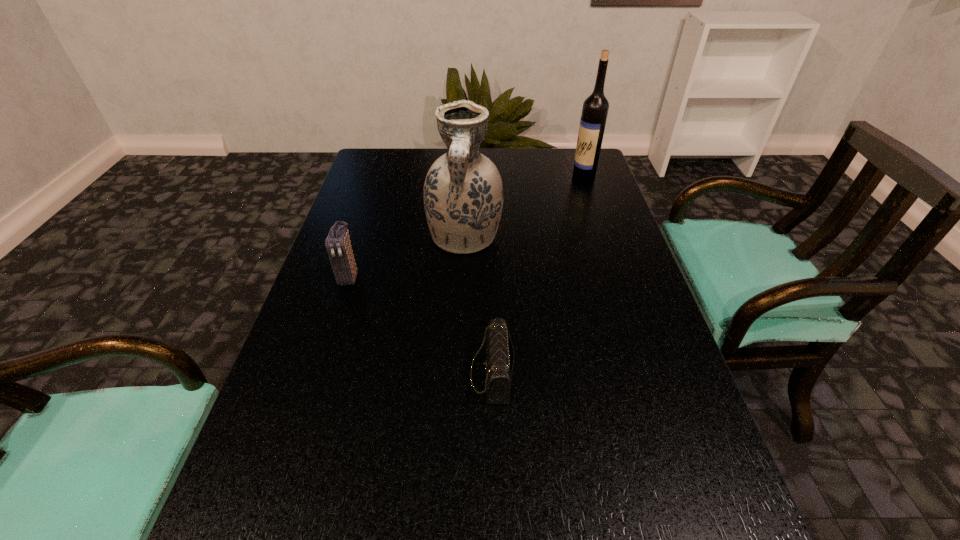
I want to click on free space located with the handle on the side of the vase, so click(x=461, y=342).

This screenshot has width=960, height=540. In order to click on vacant area located with the zip open on the farther clutch bag in this screenshot , I will do `click(306, 415)`.

Identify the location of free region located 0.060m on the front flap of the nearer clutch bag. Image resolution: width=960 pixels, height=540 pixels. (440, 374).

This screenshot has width=960, height=540. I want to click on free region located 0.120m on the front flap of the nearer clutch bag, so click(x=409, y=374).

Find the location of a particular element. Image resolution: width=960 pixels, height=540 pixels. free region located on the front flap of the nearer clutch bag is located at coordinates (297, 374).

This screenshot has height=540, width=960. Identify the location of object at the far edge. (595, 109).

In order to click on object that is at the left edge in this screenshot , I will do `click(338, 243)`.

The width and height of the screenshot is (960, 540). I want to click on object at the right edge, so click(595, 109).

In order to click on object that is at the far right corner in this screenshot , I will do `click(595, 109)`.

The height and width of the screenshot is (540, 960). In order to click on vacant position at the far edge of the desktop in this screenshot , I will do `click(543, 151)`.